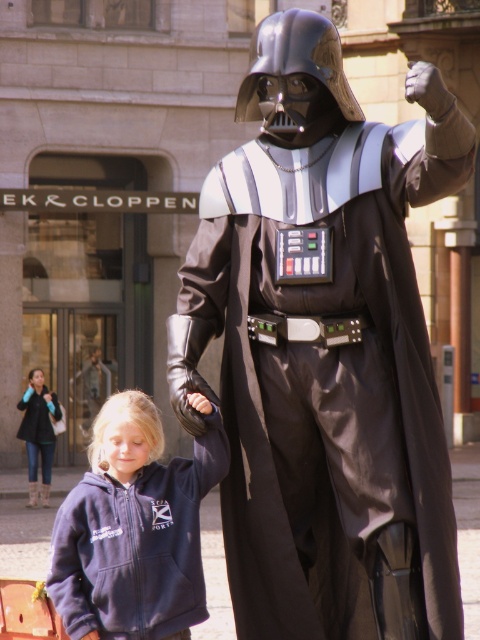
You are a photographer setting up a photo shoot in the city scene. You have two props, a navy fleece hoodie at lower left and a denim jacket at lower left. Which prop should you choose if you want to use the larger one to cover a small object?

The navy fleece hoodie at lower left has a larger size compared to the denim jacket at lower left, so you should choose the navy fleece hoodie at lower left to cover the small object.